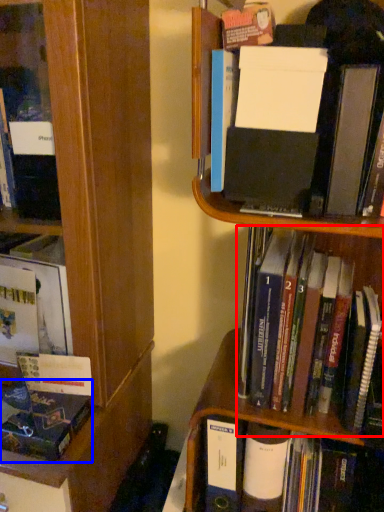
Question: Among these objects, which one is nearest to the camera, book (highlighted by a red box) or book (highlighted by a blue box)?

Choices:
 (A) book
 (B) book

Answer: (A)